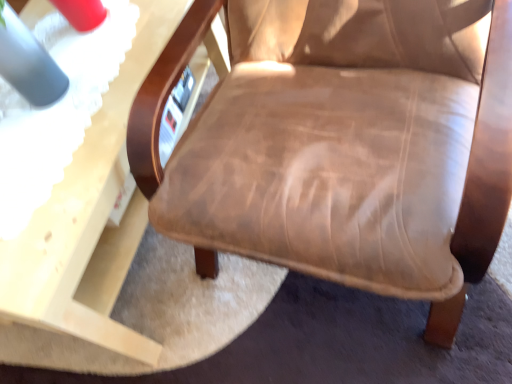
Question: Are leather-like brown chair at center and matte wood table at lower left located far from each other?

Choices:
 (A) yes
 (B) no

Answer: (B)

Question: Can you confirm if leather-like brown chair at center is bigger than matte wood table at lower left?

Choices:
 (A) yes
 (B) no

Answer: (A)

Question: Could you tell me if leather-like brown chair at center is facing matte wood table at lower left?

Choices:
 (A) yes
 (B) no

Answer: (B)

Question: From the image's perspective, is leather-like brown chair at center on matte wood table at lower left?

Choices:
 (A) yes
 (B) no

Answer: (A)

Question: Considering the relative positions of leather-like brown chair at center and matte wood table at lower left in the image provided, is leather-like brown chair at center to the right of matte wood table at lower left from the viewer's perspective?

Choices:
 (A) no
 (B) yes

Answer: (B)

Question: Is leather-like brown chair at center looking in the opposite direction of matte wood table at lower left?

Choices:
 (A) no
 (B) yes

Answer: (A)

Question: From a real-world perspective, is matte wood table at lower left below leather-like brown chair at center?

Choices:
 (A) no
 (B) yes

Answer: (B)

Question: Is matte wood table at lower left touching leather-like brown chair at center?

Choices:
 (A) yes
 (B) no

Answer: (B)

Question: Are matte wood table at lower left and leather-like brown chair at center located far from each other?

Choices:
 (A) yes
 (B) no

Answer: (B)

Question: Does matte wood table at lower left have a greater width compared to leather-like brown chair at center?

Choices:
 (A) no
 (B) yes

Answer: (B)

Question: Does matte wood table at lower left turn towards leather-like brown chair at center?

Choices:
 (A) no
 (B) yes

Answer: (A)

Question: Considering the relative sizes of matte wood table at lower left and leather-like brown chair at center in the image provided, is matte wood table at lower left taller than leather-like brown chair at center?

Choices:
 (A) yes
 (B) no

Answer: (B)

Question: Looking at their shapes, would you say leather-like brown chair at center is wider or thinner than matte wood table at lower left?

Choices:
 (A) wide
 (B) thin

Answer: (B)